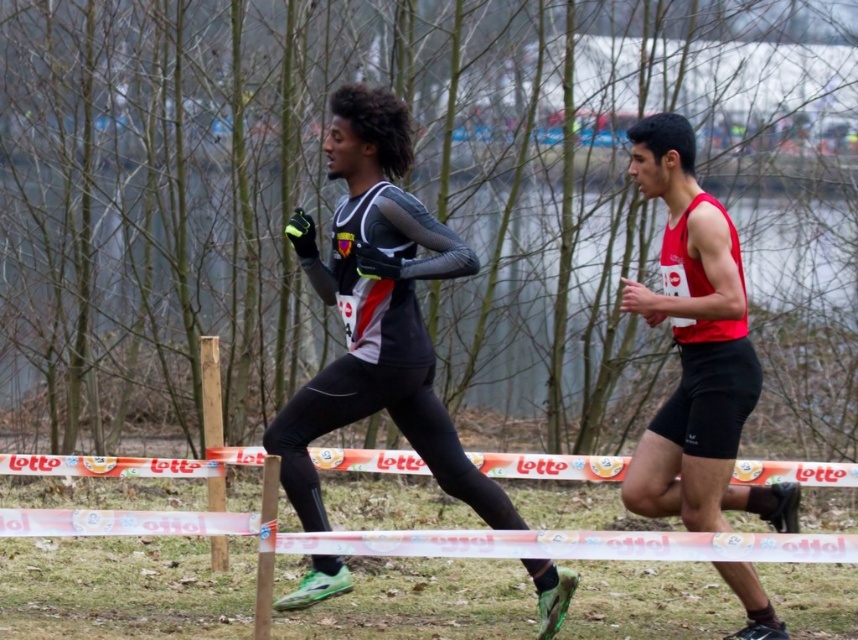
Does white plastic tape at center appear on the right side of matte red jersey at right?

No, white plastic tape at center is not to the right of matte red jersey at right.

Is point (596, 636) in front of point (720, 333)?

That is False.

Is point (131, 513) positioned after point (689, 474)?

No, (131, 513) is in front of (689, 474).

Identify the location of white plastic tape at center. (556, 561).

Is white plastic tape at center to the left of matte black running suit at center from the viewer's perspective?

No, white plastic tape at center is not to the left of matte black running suit at center.

Can you confirm if white plastic tape at center is positioned above matte black running suit at center?

No, white plastic tape at center is not above matte black running suit at center.

Is point (189, 563) less distant than point (353, 301)?

No, it is behind (353, 301).

Locate an element on the screen. white plastic tape at center is located at coordinates (556, 561).

Is matte black running suit at center wider than matte red jersey at right?

Indeed, matte black running suit at center has a greater width compared to matte red jersey at right.

Is point (385, 381) positioned behind point (657, 432)?

No, it is in front of (657, 432).

This screenshot has height=640, width=858. I want to click on matte black running suit at center, so click(x=378, y=312).